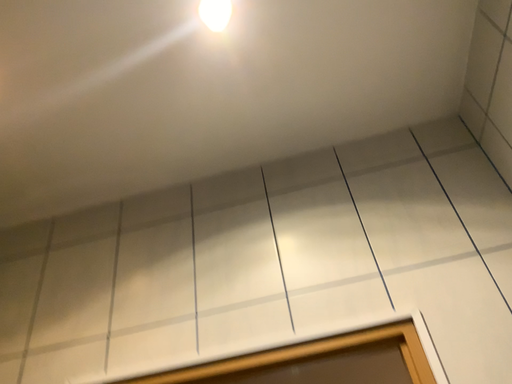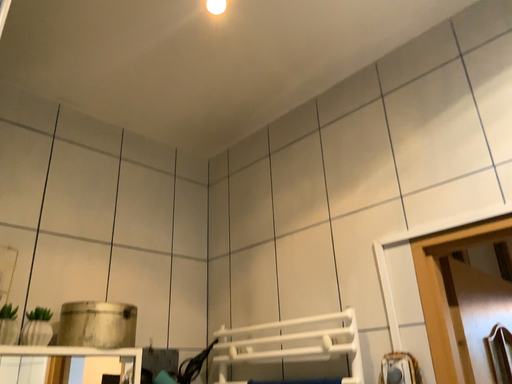
Question: How did the camera likely rotate when shooting the video?

Choices:
 (A) rotated upward
 (B) rotated downward

Answer: (B)